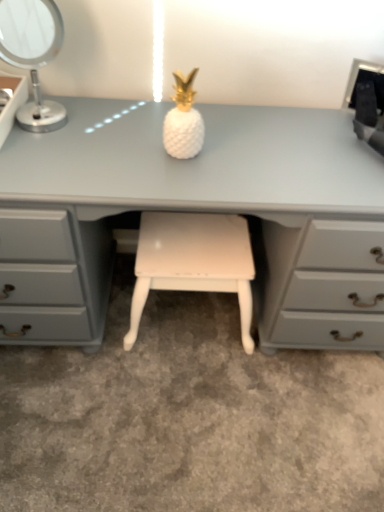
Where is `vacant space behind white glossy pineapple at center`? vacant space behind white glossy pineapple at center is located at coordinates (199, 118).